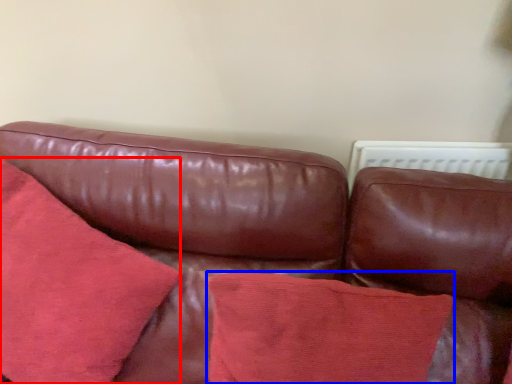
Question: Which object is closer to the camera taking this photo, throw pillow (highlighted by a red box) or throw pillow (highlighted by a blue box)?

Choices:
 (A) throw pillow
 (B) throw pillow

Answer: (A)